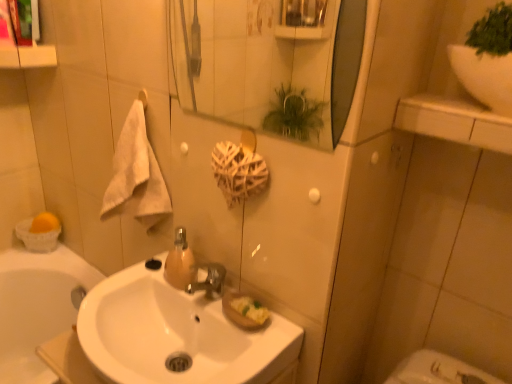
Question: Does translucent amber glass soap dispenser at center come in front of white fluffy towel at left?

Choices:
 (A) no
 (B) yes

Answer: (A)

Question: Does translucent amber glass soap dispenser at center have a lesser height compared to white fluffy towel at left?

Choices:
 (A) yes
 (B) no

Answer: (A)

Question: From a real-world perspective, is translucent amber glass soap dispenser at center located beneath white fluffy towel at left?

Choices:
 (A) yes
 (B) no

Answer: (A)

Question: Is translucent amber glass soap dispenser at center at the right side of white fluffy towel at left?

Choices:
 (A) no
 (B) yes

Answer: (B)

Question: Is translucent amber glass soap dispenser at center to the left of white fluffy towel at left from the viewer's perspective?

Choices:
 (A) no
 (B) yes

Answer: (A)

Question: Is translucent amber glass soap dispenser at center not near white fluffy towel at left?

Choices:
 (A) yes
 (B) no

Answer: (B)

Question: From the image's perspective, is glossy glass mirror at upper center on top of translucent amber glass soap dispenser at center?

Choices:
 (A) no
 (B) yes

Answer: (B)

Question: Is glossy glass mirror at upper center in front of translucent amber glass soap dispenser at center?

Choices:
 (A) yes
 (B) no

Answer: (A)

Question: Is glossy glass mirror at upper center wider than translucent amber glass soap dispenser at center?

Choices:
 (A) no
 (B) yes

Answer: (A)

Question: Is glossy glass mirror at upper center smaller than translucent amber glass soap dispenser at center?

Choices:
 (A) yes
 (B) no

Answer: (B)

Question: Is glossy glass mirror at upper center outside translucent amber glass soap dispenser at center?

Choices:
 (A) no
 (B) yes

Answer: (B)

Question: Is glossy glass mirror at upper center behind translucent amber glass soap dispenser at center?

Choices:
 (A) yes
 (B) no

Answer: (B)

Question: Would you say white glossy sink at upper right is outside white glossy sink at center?

Choices:
 (A) yes
 (B) no

Answer: (A)